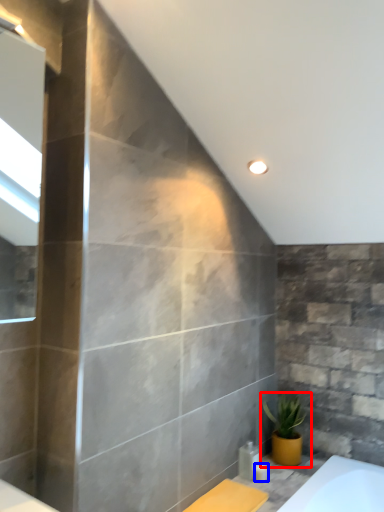
Question: Which point is further to the camera, houseplant (highlighted by a red box) or toiletry (highlighted by a blue box)?

Choices:
 (A) houseplant
 (B) toiletry

Answer: (A)